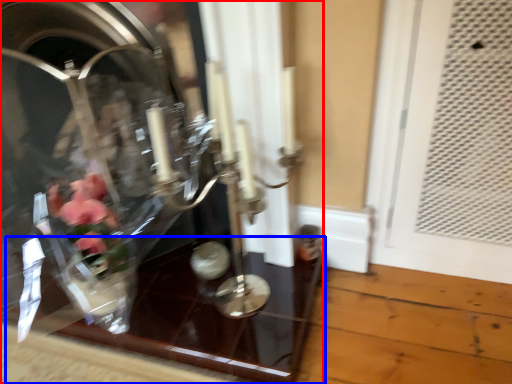
Question: Among these objects, which one is farthest to the camera, glass box (highlighted by a red box) or glass table (highlighted by a blue box)?

Choices:
 (A) glass box
 (B) glass table

Answer: (B)